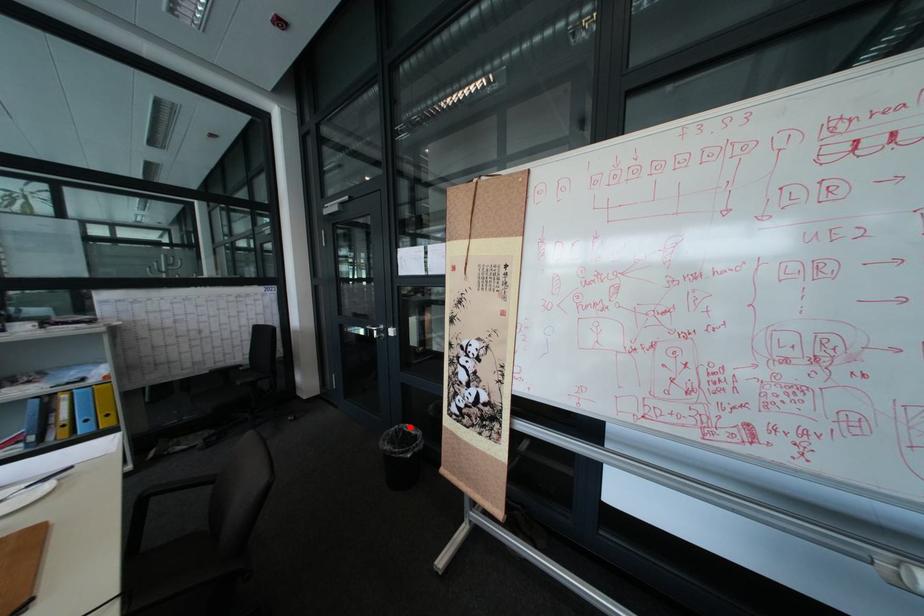
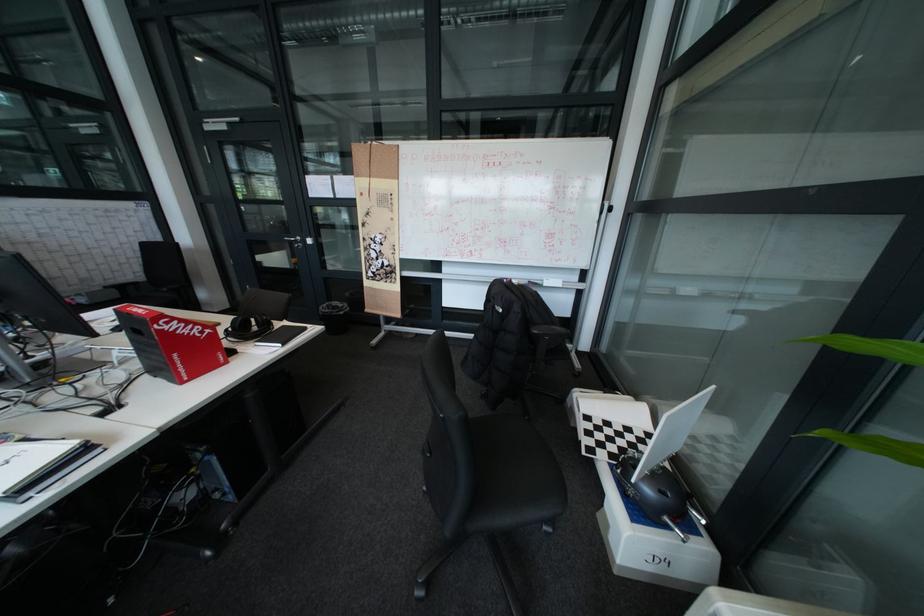
Find the pixel in the second image that matches the highlighted location in the first image.

(341, 304)